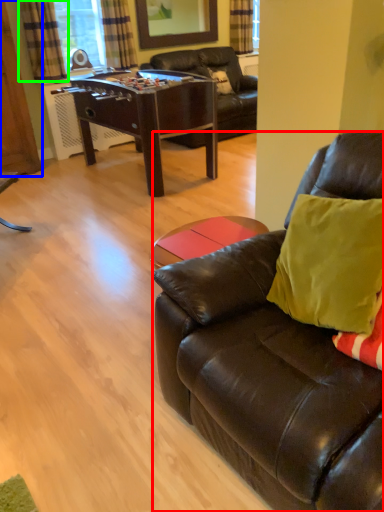
Question: Considering the real-world distances, which object is farthest from studio couch (highlighted by a red box)? armoire (highlighted by a blue box) or curtain (highlighted by a green box)?

Choices:
 (A) armoire
 (B) curtain

Answer: (B)